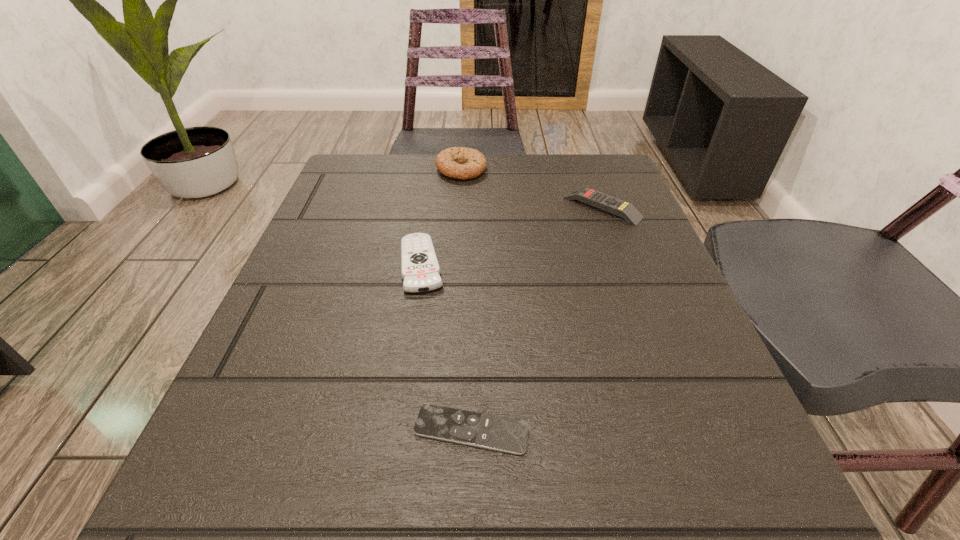
Find the location of `free spot between the farthest object and the third farthest object`. free spot between the farthest object and the third farthest object is located at coordinates (442, 217).

Find the location of a particular element. free space between the nearest remote control and the second nearest remote control is located at coordinates (446, 347).

Find the location of a particular element. free space that is in between the third shortest object and the third farthest object is located at coordinates (512, 236).

This screenshot has height=540, width=960. I want to click on object that is the second closest one to the second nearest remote control, so click(463, 163).

The height and width of the screenshot is (540, 960). I want to click on object identified as the third closest to the farthest object, so click(x=491, y=432).

The height and width of the screenshot is (540, 960). I want to click on remote control that stands as the second closest to the nearest object, so click(626, 210).

Choose which remote control is the nearest neighbor to the second nearest remote control. Please provide its 2D coordinates. Your answer should be formatted as a tuple, i.e. [(x, y)], where the tuple contains the x and y coordinates of a point satisfying the conditions above.

[(491, 432)]

You are a GUI agent. You are given a task and a screenshot of the screen. Output one action in this format:
    pyautogui.click(x=<x>, y=<y>)
    Task: Click on the vacant point that satisfies the following two spatial constraints: 1. on the front side of the farthest remote control; 2. on the right side of the tallest object
    
    Given the screenshot: What is the action you would take?
    pyautogui.click(x=459, y=207)

In order to click on vacant space that satisfies the following two spatial constraints: 1. on the front side of the shortest object; 2. on the left side of the bagel in this screenshot , I will do coord(444,430).

I want to click on vacant region that satisfies the following two spatial constraints: 1. on the front side of the nearest object; 2. on the right side of the second shortest object, so click(396, 430).